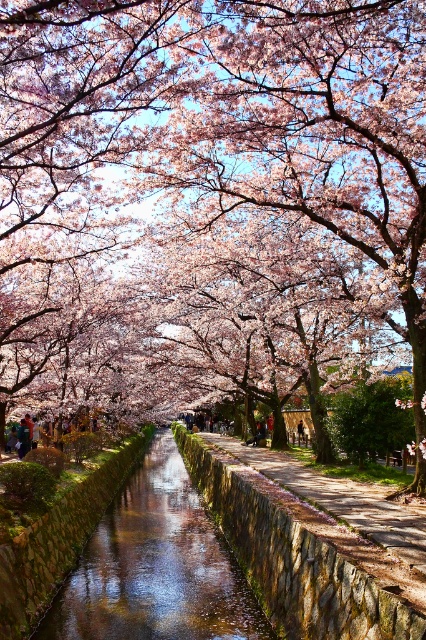
Question: Is clear water at center further to the viewer compared to stone paved path at center?

Choices:
 (A) no
 (B) yes

Answer: (B)

Question: Which point is farther from the camera taking this photo?

Choices:
 (A) (192, 632)
 (B) (363, 513)
 (C) (256, 424)

Answer: (C)

Question: Does stone paved path at center have a lesser width compared to dark blue fabric person at center?

Choices:
 (A) yes
 (B) no

Answer: (B)

Question: Which object appears farthest from the camera in this image?

Choices:
 (A) stone paved path at center
 (B) clear water at center
 (C) dark blue fabric person at center

Answer: (C)

Question: Which object appears closest to the camera in this image?

Choices:
 (A) dark blue fabric person at center
 (B) stone paved path at center
 (C) clear water at center

Answer: (B)

Question: From the image, what is the correct spatial relationship of clear water at center in relation to dark blue fabric person at center?

Choices:
 (A) left
 (B) right

Answer: (A)